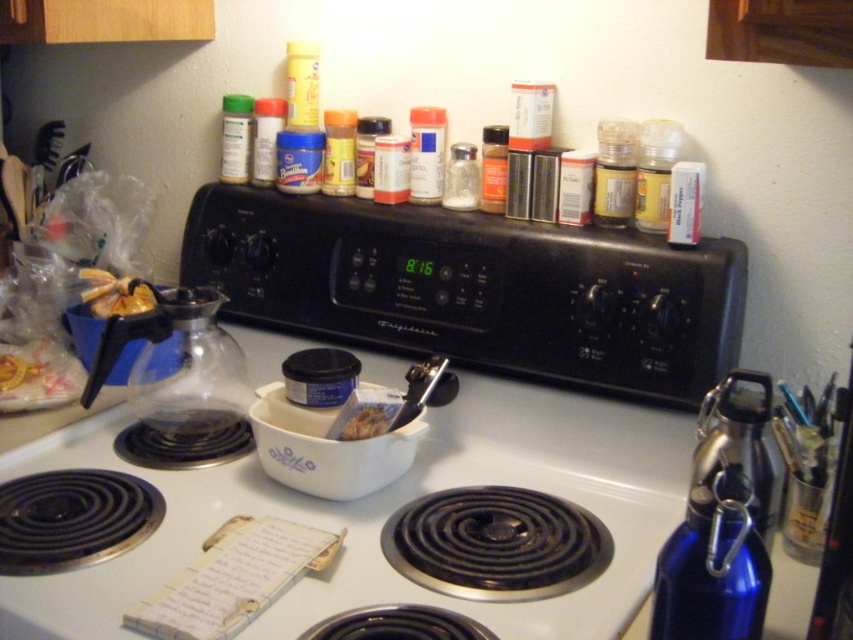
Question: Which of the following is the farthest from the observer?

Choices:
 (A) (740, 636)
 (B) (329, 332)
 (C) (659, 176)

Answer: (B)

Question: Estimate the real-world distances between objects in this image. Which object is farther from the matte plastic spice container at center?

Choices:
 (A) yellow plastic bottle at upper right
 (B) blue metallic water bottle at lower right

Answer: (B)

Question: Can you confirm if black plastic stove at upper center is positioned to the left of yellow plastic bottle at upper right?

Choices:
 (A) yes
 (B) no

Answer: (A)

Question: Can you confirm if yellow plastic bottle at upper right is positioned below yellow matte spice jar at center?

Choices:
 (A) no
 (B) yes

Answer: (B)

Question: Estimate the real-world distances between objects in this image. Which object is closer to the yellow crumpled paper at upper left?

Choices:
 (A) matte glass spice jar at upper right
 (B) transparent glass carafe at center
 (C) brown crumbly food at center

Answer: (B)

Question: Does black plastic stove at upper center appear on the left side of matte plastic spice container at center?

Choices:
 (A) yes
 (B) no

Answer: (B)